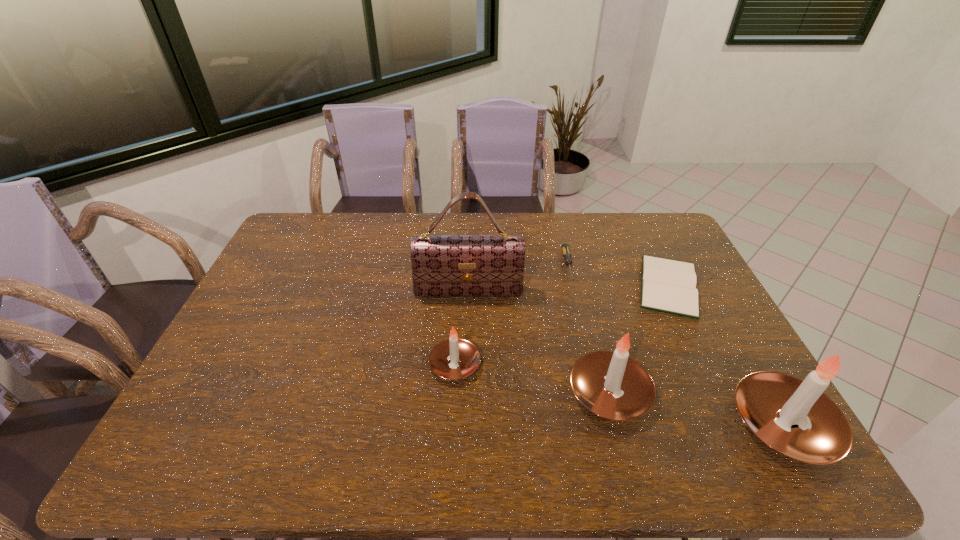
I want to click on free space at the right edge of the desktop, so click(x=703, y=291).

At what (x,y) coordinates should I click in order to perform the action: click on vacant area between the rightmost candle and the screwdriver. Please return your answer as a coordinate pair (x, y). This screenshot has width=960, height=540. Looking at the image, I should click on (676, 345).

What are the coordinates of `unoccupied position between the second candle from left to right and the handbag` in the screenshot? It's located at (539, 342).

This screenshot has width=960, height=540. Find the location of `free space between the fourth shortest object and the tallest object`. free space between the fourth shortest object and the tallest object is located at coordinates (539, 342).

The height and width of the screenshot is (540, 960). I want to click on empty space between the tallest object and the leftmost candle, so [462, 328].

Identify the location of vacant space that's between the second tallest candle and the handbag. (539, 342).

This screenshot has width=960, height=540. Identify the location of free spot between the second tallest candle and the tallest object. (539, 342).

The image size is (960, 540). Find the location of `free space between the screwdriver and the leftmost candle`. free space between the screwdriver and the leftmost candle is located at coordinates (512, 314).

Locate an element on the screen. This screenshot has width=960, height=540. object that ranks as the closest to the rightmost candle is located at coordinates (612, 385).

Identify which object is the fourth nearest to the handbag. Please provide its 2D coordinates. Your answer should be formatted as a tuple, i.e. [(x, y)], where the tuple contains the x and y coordinates of a point satisfying the conditions above.

[(667, 285)]